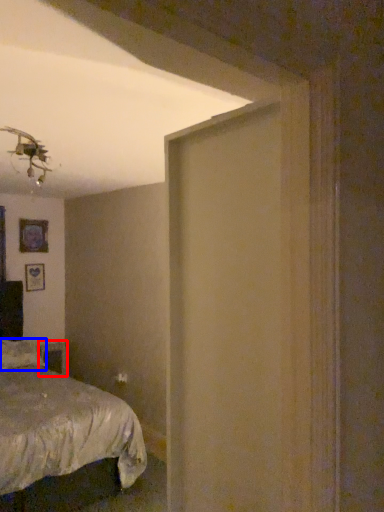
Question: Which object is closer to the camera taking this photo, table (highlighted by a red box) or pillow (highlighted by a blue box)?

Choices:
 (A) table
 (B) pillow

Answer: (B)